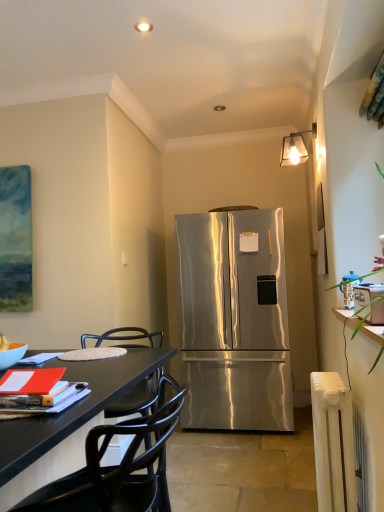
Question: Considering their positions, is stainless steel refrigerator at center located in front of or behind clear glass lampshade at upper center?

Choices:
 (A) front
 (B) behind

Answer: (B)

Question: In terms of size, does stainless steel refrigerator at center appear bigger or smaller than clear glass lampshade at upper center?

Choices:
 (A) small
 (B) big

Answer: (B)

Question: Estimate the real-world distances between objects in this image. Which object is farther from the stainless steel refrigerator at center?

Choices:
 (A) clear glass lampshade at upper center
 (B) black matte chair at lower left
 (C) white plastic radiator at lower right
 (D) matte orange book at lower left

Answer: (B)

Question: Estimate the real-world distances between objects in this image. Which object is closer to the clear glass lampshade at upper center?

Choices:
 (A) matte orange book at lower left
 (B) black matte chair at lower left
 (C) white plastic radiator at lower right
 (D) stainless steel refrigerator at center

Answer: (D)